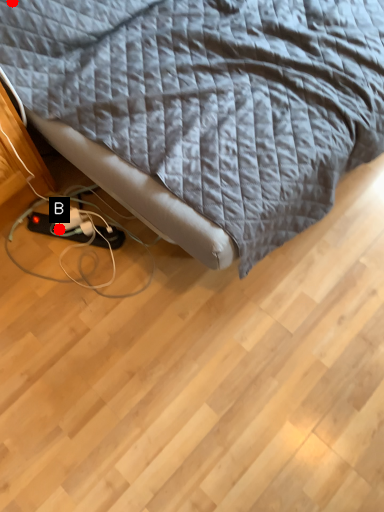
Question: Two points are circled on the image, labeled by A and B beside each circle. Which point is closer to the camera?

Choices:
 (A) A is closer
 (B) B is closer

Answer: (A)